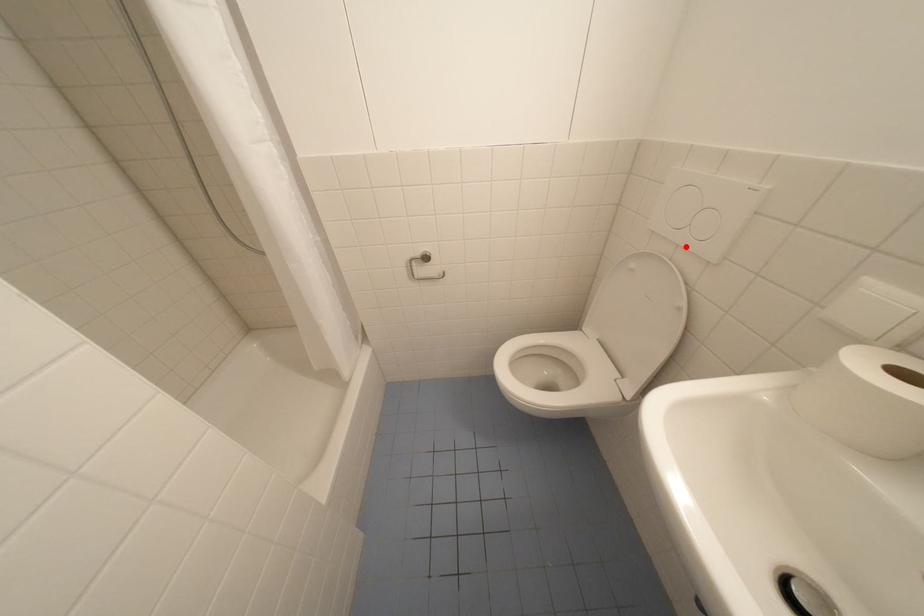
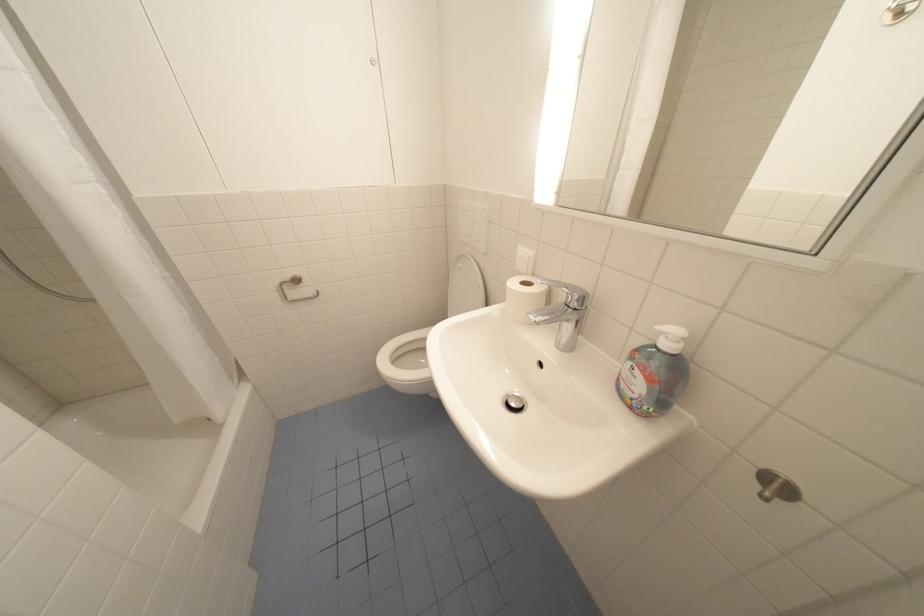
Where in the second image is the point corresponding to the highlighted location from the first image?

(480, 248)